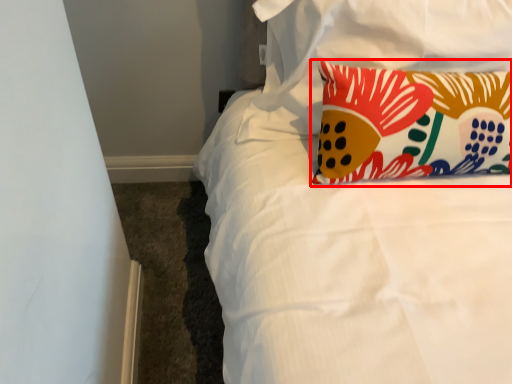
Question: Considering the relative positions of pillow (annotated by the red box) and pillow in the image provided, where is pillow (annotated by the red box) located with respect to the staircase?

Choices:
 (A) right
 (B) left

Answer: (A)